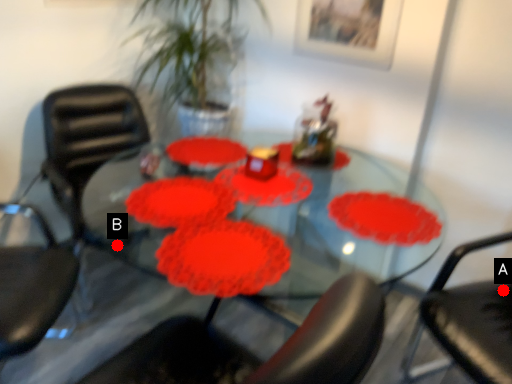
Question: Two points are circled on the image, labeled by A and B beside each circle. Which of the following is the farthest from the observer?

Choices:
 (A) A is further
 (B) B is further

Answer: (B)